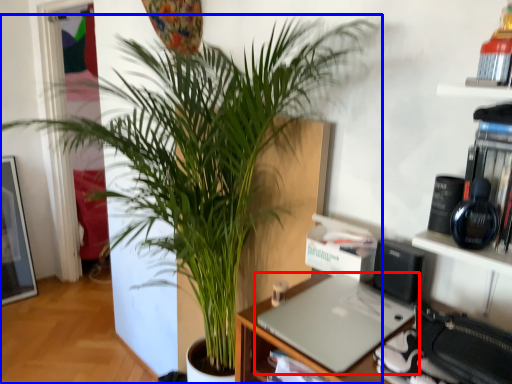
Question: Which object appears farthest to the camera in this image, laptop (highlighted by a red box) or houseplant (highlighted by a blue box)?

Choices:
 (A) laptop
 (B) houseplant

Answer: (A)